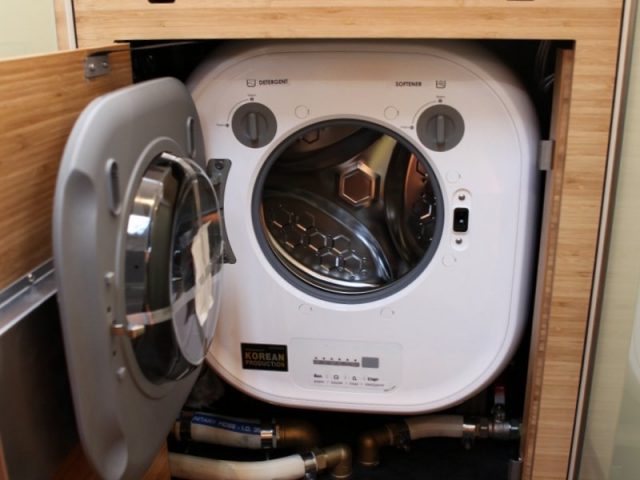
Where is `pipes underneath washing machine`? Image resolution: width=640 pixels, height=480 pixels. pipes underneath washing machine is located at coordinates (297, 465), (346, 450), (448, 426), (500, 425), (278, 429), (230, 432), (192, 427), (189, 470), (249, 470).